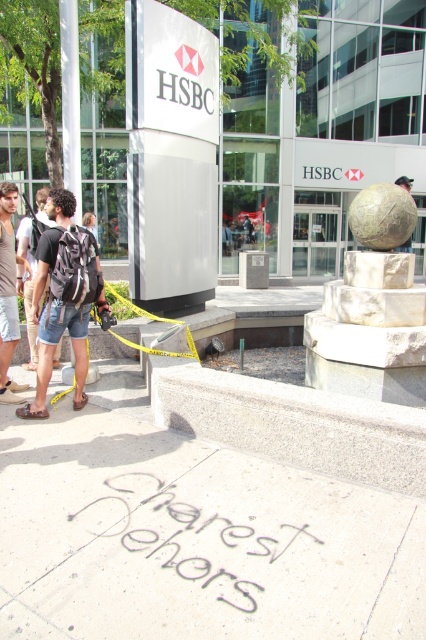
You are a delivery person trying to deliver a package to the HSBC bank branch. You see the polished bronze sphere at center and the light brown denim shorts at left. Which object is wider?

The polished bronze sphere at center is wider than the light brown denim shorts at left.

You are a delivery person trying to read the white plastic sign at center but you notice light brown denim shorts at left are blocking your view. Can you see the sign clearly?

The white plastic sign at center is shorter than light brown denim shorts at left. Since the sign is shorter than the shorts, the shorts are likely blocking the view of the sign.